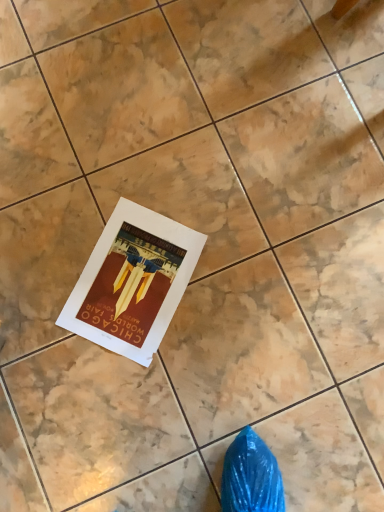
Locate an element on the screen. Image resolution: width=384 pixels, height=512 pixels. free space above matte paper poster at center (from a real-world perspective) is located at coordinates (128, 282).